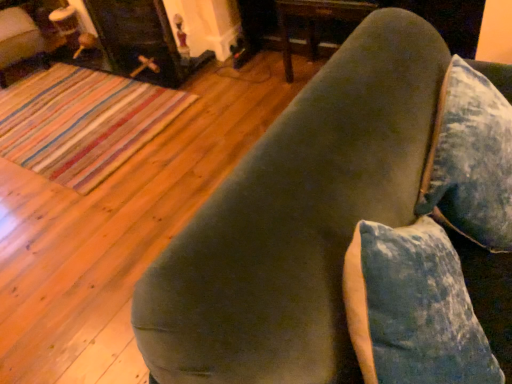
Question: Can matte black fireplace at upper left be found inside velvet green couch at upper right?

Choices:
 (A) yes
 (B) no

Answer: (B)

Question: Considering the relative sizes of velvet green couch at upper right and matte black fireplace at upper left in the image provided, is velvet green couch at upper right taller than matte black fireplace at upper left?

Choices:
 (A) yes
 (B) no

Answer: (B)

Question: Can you confirm if velvet green couch at upper right is thinner than matte black fireplace at upper left?

Choices:
 (A) yes
 (B) no

Answer: (B)

Question: Is velvet green couch at upper right further to camera compared to matte black fireplace at upper left?

Choices:
 (A) yes
 (B) no

Answer: (B)

Question: Can you confirm if velvet green couch at upper right is smaller than matte black fireplace at upper left?

Choices:
 (A) yes
 (B) no

Answer: (A)

Question: Is velvet green couch at upper right aimed at matte black fireplace at upper left?

Choices:
 (A) yes
 (B) no

Answer: (B)

Question: Is velvet green couch at upper right a part of matte black fireplace at upper left?

Choices:
 (A) no
 (B) yes

Answer: (A)

Question: Does matte black fireplace at upper left turn towards velvet green couch at upper right?

Choices:
 (A) no
 (B) yes

Answer: (A)

Question: Considering the relative sizes of matte black fireplace at upper left and velvet green couch at upper right in the image provided, is matte black fireplace at upper left shorter than velvet green couch at upper right?

Choices:
 (A) yes
 (B) no

Answer: (B)

Question: From a real-world perspective, is matte black fireplace at upper left below velvet green couch at upper right?

Choices:
 (A) yes
 (B) no

Answer: (A)

Question: Is matte black fireplace at upper left closer to the viewer compared to velvet green couch at upper right?

Choices:
 (A) no
 (B) yes

Answer: (A)

Question: Would you say matte black fireplace at upper left is a long distance from velvet green couch at upper right?

Choices:
 (A) yes
 (B) no

Answer: (A)

Question: Considering the positions of matte black fireplace at upper left and velvet green couch at upper right in the image, is matte black fireplace at upper left wider or thinner than velvet green couch at upper right?

Choices:
 (A) thin
 (B) wide

Answer: (A)